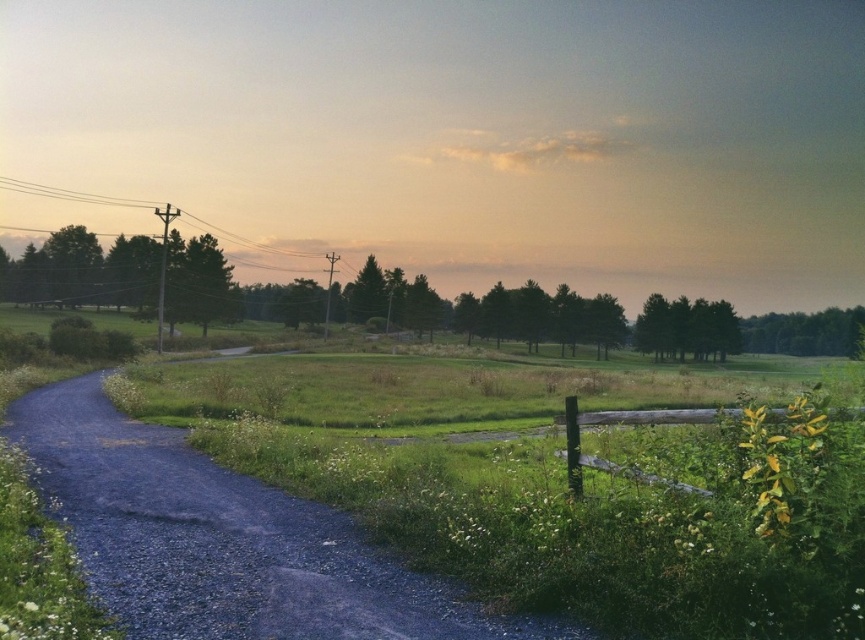
Is point (840, 344) closer to viewer compared to point (190, 216)?

That is True.

Does point (862, 321) lie behind point (79, 192)?

No, (862, 321) is in front of (79, 192).

Find the location of `green leafy trees at right`. green leafy trees at right is located at coordinates 804,332.

Which is behind, point (266, 522) or point (747, 348)?

Positioned behind is point (747, 348).

Does gravelly dirt path at center appear over green leafy trees at right?

No, gravelly dirt path at center is not above green leafy trees at right.

Locate an element on the screen. gravelly dirt path at center is located at coordinates (223, 540).

The image size is (865, 640). I want to click on gravelly dirt path at center, so click(x=223, y=540).